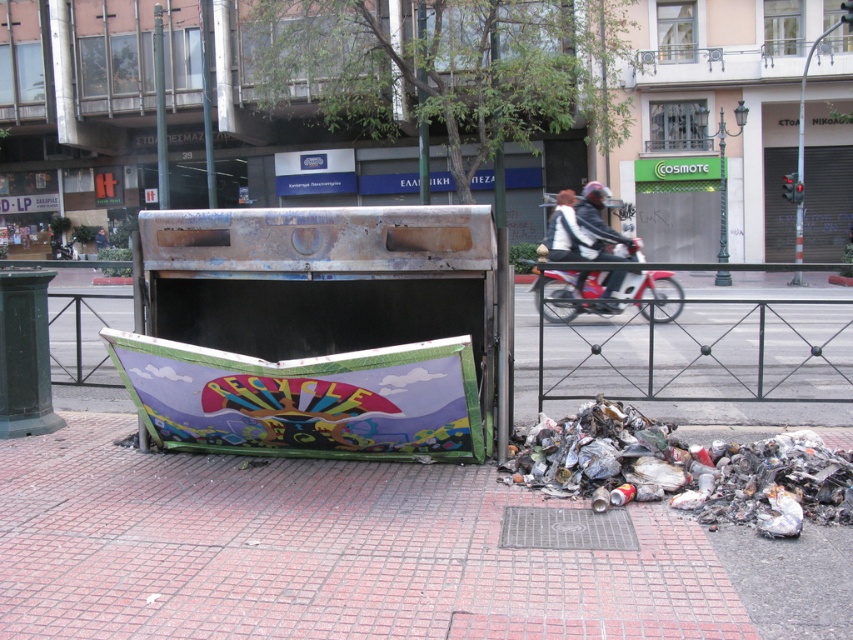
You are a delivery person trying to park your metallic red motorcycle at center near the brick pavement at lower left. Can you park it there without moving any other objects?

The brick pavement at lower left is to the left of metallic red motorcycle at center, so yes, you can park the metallic red motorcycle at center near the brick pavement at lower left without moving any other objects.

Looking at this image, you are a delivery person standing on the brick pavement at lower left and need to place a package on the white leather jacket at center. Can you reach the jacket without stepping off the pavement?

The brick pavement at lower left is shorter than the white leather jacket at center, so you can reach the jacket without stepping off the pavement since the jacket is taller than the pavement.

You are a city planner evaluating the space around the recycling bin. Given the brick pavement at lower left and the white leather jacket at center, which one is wider?

The brick pavement at lower left is wider than the white leather jacket at center.